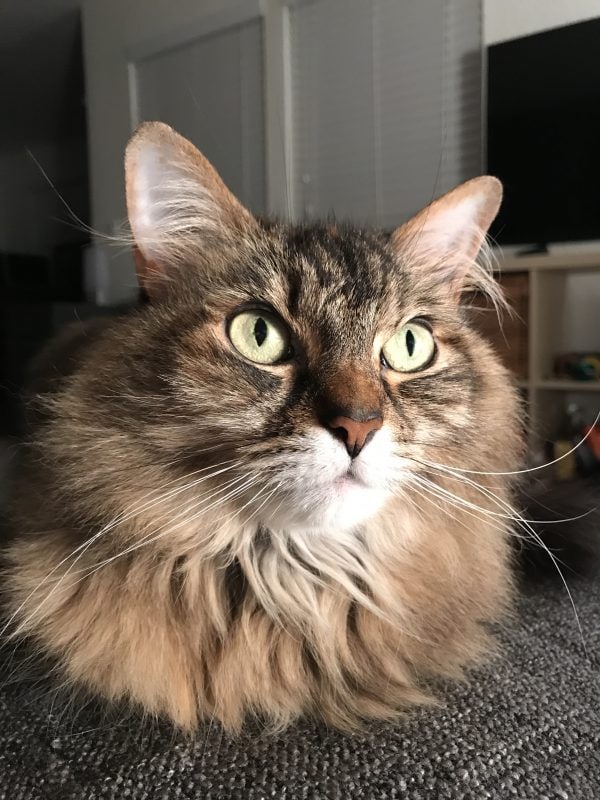
You are a GUI agent. You are given a task and a screenshot of the screen. Output one action in this format:
    pyautogui.click(x=<x>, y=<y>)
    Task: Click on the item underneath tv
    This screenshot has height=800, width=600.
    Given the screenshot: What is the action you would take?
    pyautogui.click(x=577, y=362)